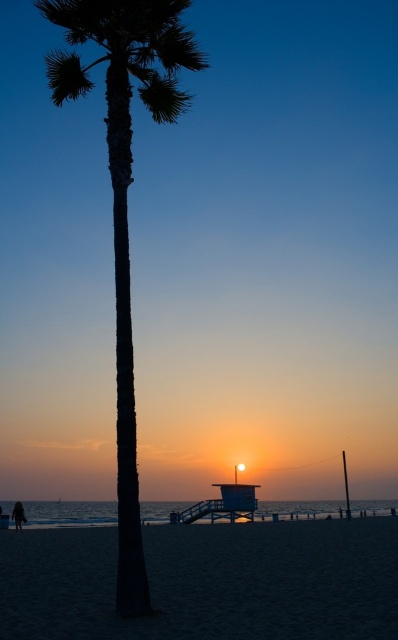
You are standing on the beach and want to take a photo of the dark green textured palm tree at center and the dark skin person at lower left. Which object occupies more horizontal space in the photo?

The dark green textured palm tree at center occupies more horizontal space in the photo because its width is larger than the dark skin person at lower left.